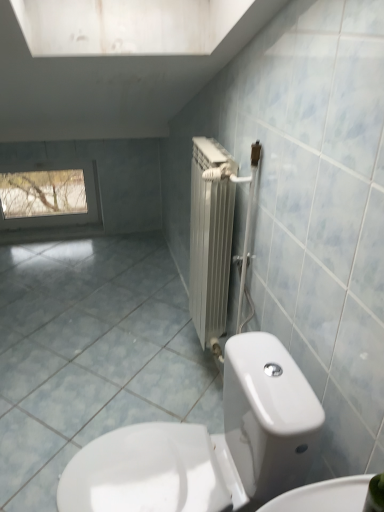
Question: Considering the positions of clear glass window at upper left and white glossy toilet at lower center in the image, is clear glass window at upper left taller or shorter than white glossy toilet at lower center?

Choices:
 (A) tall
 (B) short

Answer: (B)

Question: From a real-world perspective, is clear glass window at upper left physically located above or below white glossy toilet at lower center?

Choices:
 (A) above
 (B) below

Answer: (B)

Question: Which is nearer to the clear glass window at upper left?

Choices:
 (A) blue glossy tile at center
 (B) white glossy toilet at lower center

Answer: (A)

Question: Considering the real-world distances, which object is farthest from the white glossy toilet at lower center?

Choices:
 (A) blue glossy tile at center
 (B) clear glass window at upper left

Answer: (B)